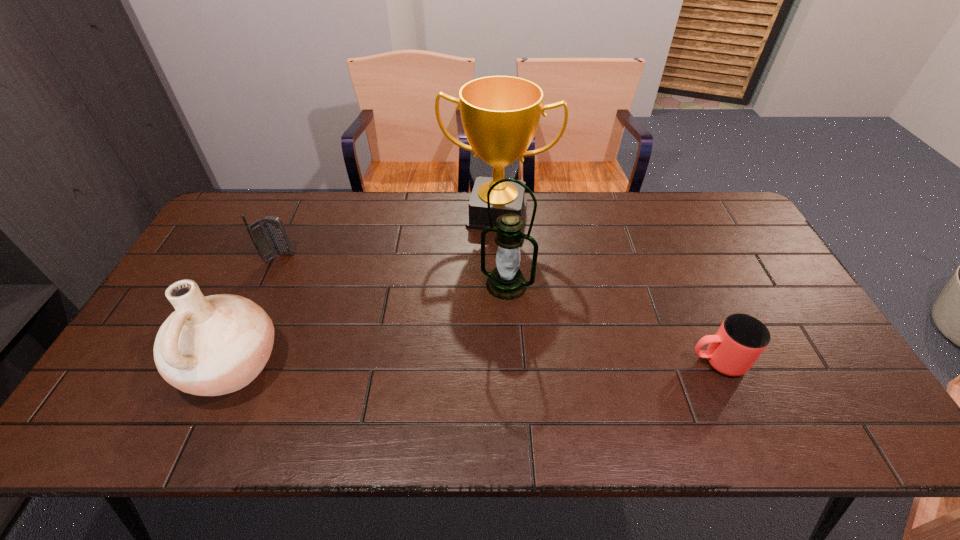
I want to click on vacant space located 0.280m on the front-facing side of the award, so click(474, 300).

Where is `vacant space located on the front-facing side of the award`? This screenshot has width=960, height=540. vacant space located on the front-facing side of the award is located at coordinates (478, 280).

Where is `free point located 0.210m on the front-facing side of the award`? free point located 0.210m on the front-facing side of the award is located at coordinates (478, 282).

Where is `object that is at the far edge`? object that is at the far edge is located at coordinates (500, 114).

Where is `pottery positioned at the near edge`? This screenshot has width=960, height=540. pottery positioned at the near edge is located at coordinates (214, 345).

The width and height of the screenshot is (960, 540). What are the coordinates of `cup located at the near edge` in the screenshot? It's located at (741, 339).

Find the location of a particular element. object that is positioned at the left edge is located at coordinates (214, 345).

The height and width of the screenshot is (540, 960). I want to click on object located at the near left corner, so click(x=214, y=345).

In the image, there is a desktop. Where is `vacant space at the far edge`? The image size is (960, 540). vacant space at the far edge is located at coordinates (334, 233).

At what (x,y) coordinates should I click in order to perform the action: click on free space at the near edge. Please return your answer as a coordinate pair (x, y). Looking at the image, I should click on (409, 396).